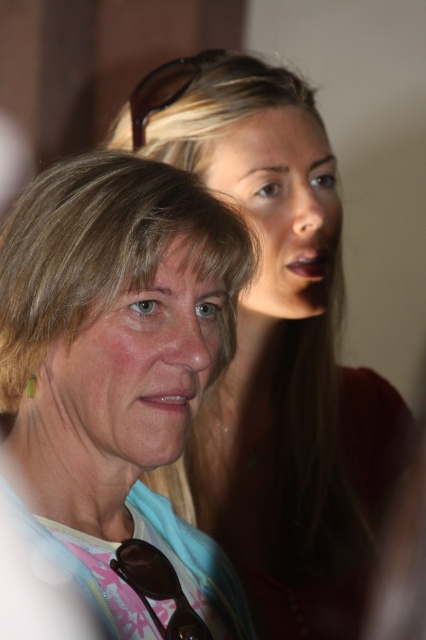
Based on the scene description, where is the matte skin at center located in terms of coordinates?

The matte skin at center is located at coordinates point (276, 352).

Consider the image. You are taking a photo of two people in a warm, softly lit environment. You notice two points in the image at coordinates point (77, 481) and point (276, 131). Which of these points is closer to you, the photographer?

Point (77, 481) is closer to the viewer than point (276, 131).

You are a photographer who wants to ensure both the matte white shirt at center and the smooth skin face at center are clearly visible in the photo. Given their sizes, which object should you focus on to ensure both are in focus?

The matte white shirt at center is larger than the smooth skin face at center, so focusing on the matte white shirt at center will help ensure both are in focus because it is the larger object and requires more depth of field.